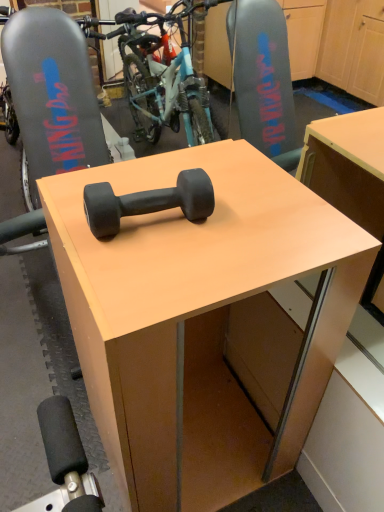
Where is `free location to the left of black rubber dumbbell at center`? free location to the left of black rubber dumbbell at center is located at coordinates (64, 206).